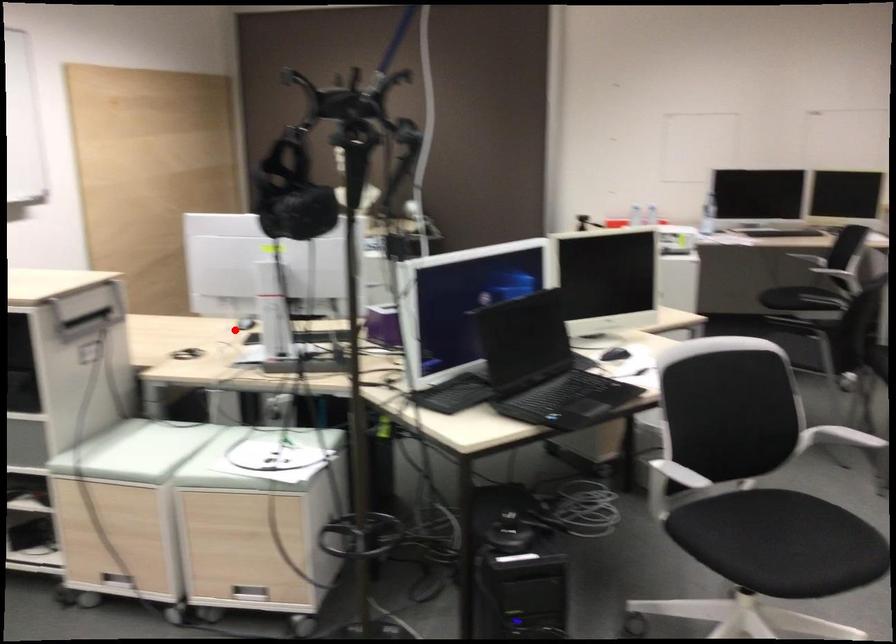
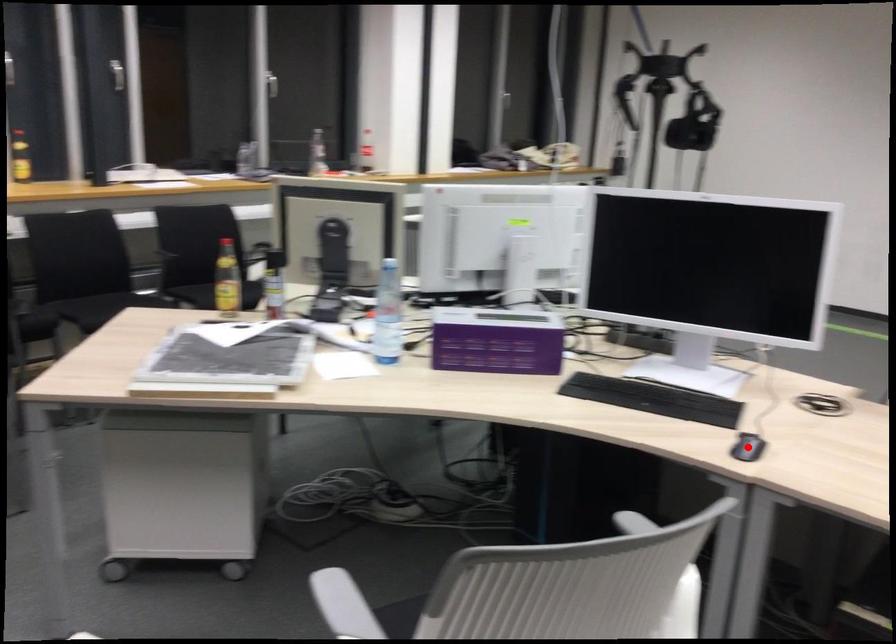
I am providing you with two images of the same scene from different viewpoints. A red point is marked on the first image and another point is marked on the second image. Is the marked point in image1 the same physical position as the marked point in image2?

Yes